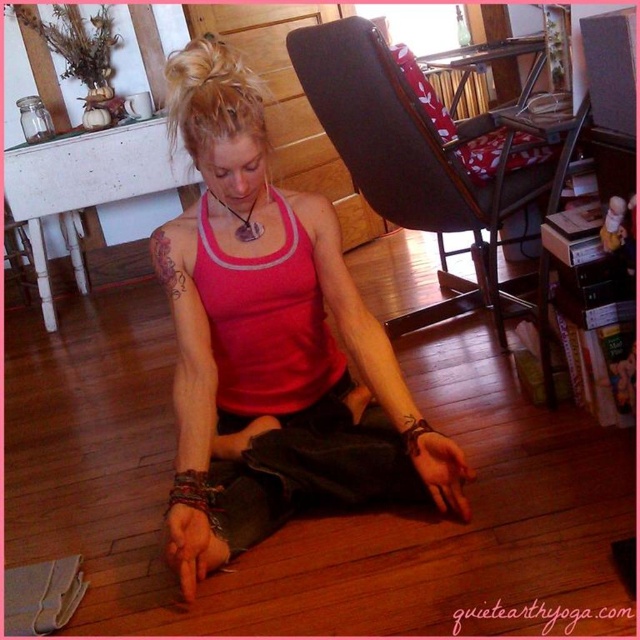
Question: Does dark brown leather chair at center appear on the left side of blondehair at center?

Choices:
 (A) no
 (B) yes

Answer: (A)

Question: Does dark brown leather chair at center have a larger size compared to blondehair at center?

Choices:
 (A) yes
 (B) no

Answer: (A)

Question: Which of the following is the closest to the observer?

Choices:
 (A) (209, 493)
 (B) (189, 252)
 (C) (234, 113)
 (D) (332, 92)

Answer: (C)

Question: Can you confirm if pink fabric tank top at center is positioned to the left of blondehair at center?

Choices:
 (A) yes
 (B) no

Answer: (B)

Question: Among these points, which one is nearest to the camera?

Choices:
 (A) (212, 108)
 (B) (305, 56)

Answer: (A)

Question: Which is nearer to the dark brown leather chair at center?

Choices:
 (A) blondehair at center
 (B) brown ink tattoo at upper left
 (C) pink fabric tank top at center

Answer: (C)